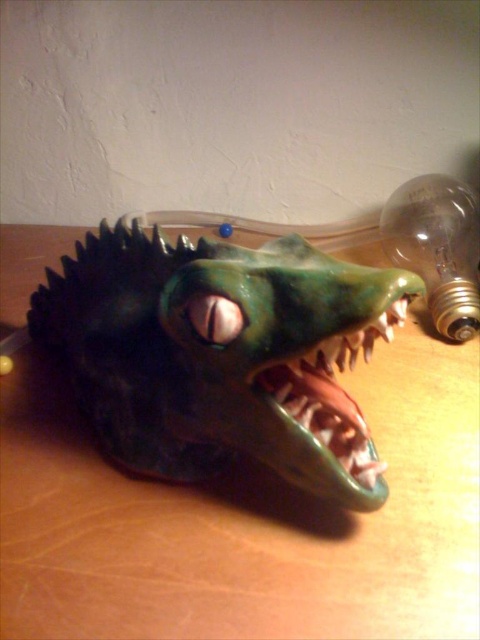
Question: Can you confirm if green matte crocodile head at center is bigger than shiny metallic teeth at center?

Choices:
 (A) no
 (B) yes

Answer: (B)

Question: Is green matte crocodile head at center below shiny metallic teeth at center?

Choices:
 (A) no
 (B) yes

Answer: (A)

Question: Does green matte crocodile head at center have a smaller size compared to shiny metallic teeth at center?

Choices:
 (A) no
 (B) yes

Answer: (A)

Question: Which object appears farthest from the camera in this image?

Choices:
 (A) translucent glass bulb at upper right
 (B) shiny metallic teeth at center

Answer: (A)

Question: Which of the following is the closest to the observer?

Choices:
 (A) shiny metallic teeth at center
 (B) green matte crocodile head at center

Answer: (B)

Question: Considering the real-world distances, which object is closest to the green matte crocodile head at center?

Choices:
 (A) shiny metallic teeth at center
 (B) translucent glass bulb at upper right

Answer: (A)